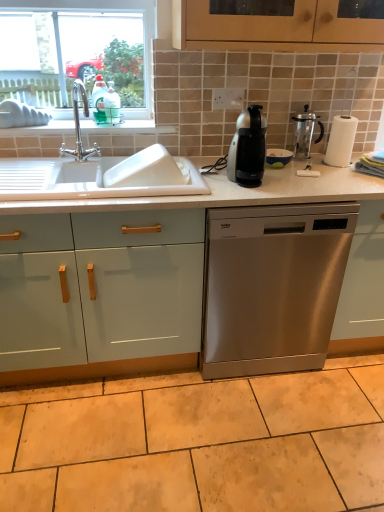
Image resolution: width=384 pixels, height=512 pixels. I want to click on vacant region to the right of satin black coffee machine at center, so click(291, 183).